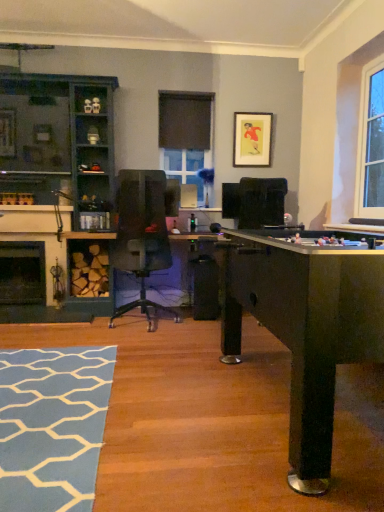
At what (x,y) coordinates should I click in order to perform the action: click on free space above black matte fireplace at lower left, which is the second fireplace in back-to-front order (from a real-world perspective). Please return your answer as a coordinate pair (x, y). Looking at the image, I should click on (30, 212).